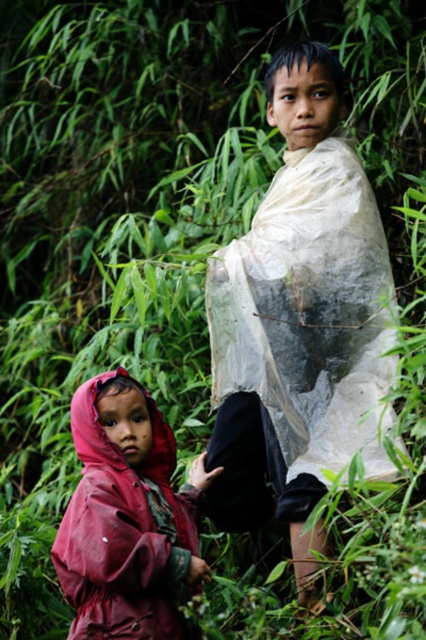
You are a delivery robot with a 1.5 meter wide package. You need to move from the rubberized red raincoat at lower left to the white plastic bag at center. Can you pass through the space between them?

The distance between the rubberized red raincoat at lower left and the white plastic bag at center is 1.73 meters. Since your package is 1.5 meters wide, you can pass through the space between them as there is enough clearance.

You are a photographer trying to capture both the white plastic bag at center and the rubberized red raincoat at lower left in the same frame. Based on their positions, which object should you focus on first to ensure both are in focus?

You should focus on the white plastic bag at center first because it is closer to the viewer than the rubberized red raincoat at lower left. By focusing on the closer object, the farther one will also be in focus due to the depth of field.

You are a photographer trying to capture the white plastic bag at center in the image. Based on the coordinates provided, where should you focus your camera to ensure the bag is in the center of your shot?

The white plastic bag at center is located at coordinates point (299, 321), so you should focus your camera there to center it in your shot.